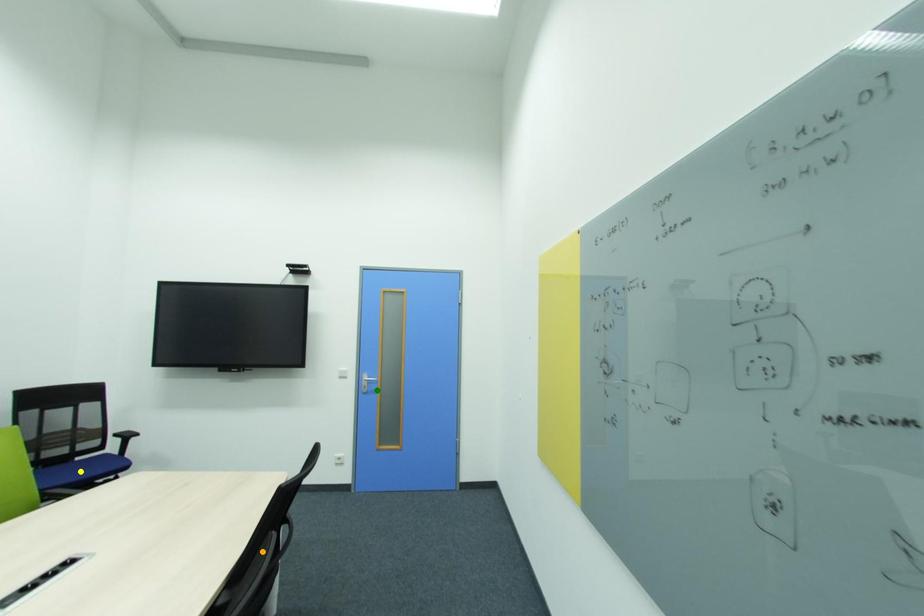
Order these from farthest to nearest:
orange point, yellow point, green point

green point
yellow point
orange point